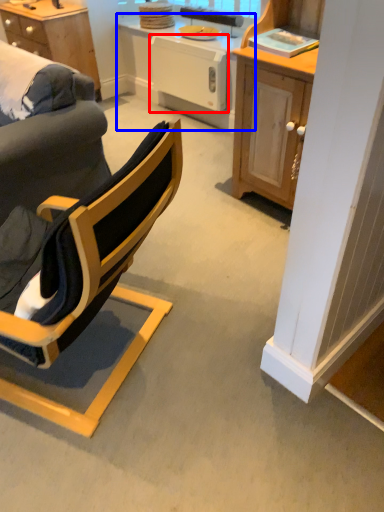
Question: Which of the following is the closest to the observer, dish washer (highlighted by a red box) or table (highlighted by a blue box)?

Choices:
 (A) dish washer
 (B) table

Answer: (B)